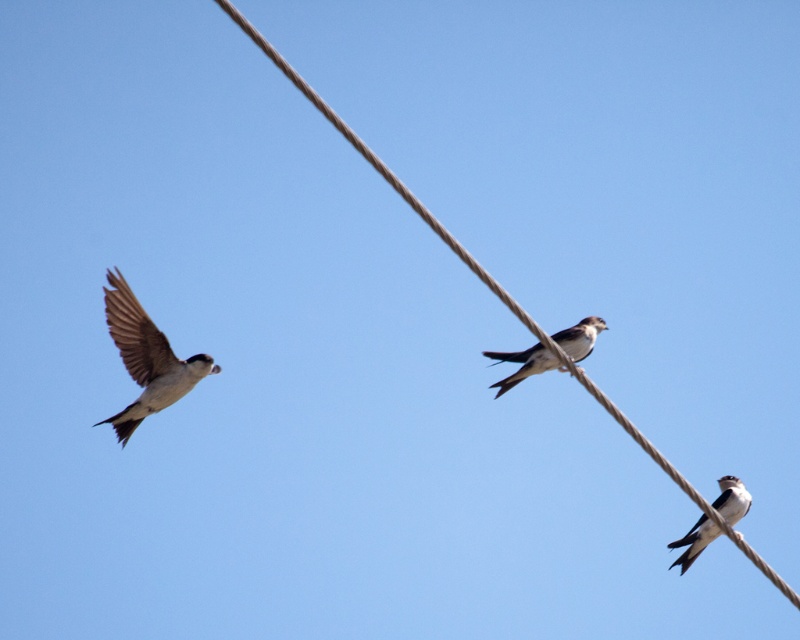
Question: Which object appears closest to the camera in this image?

Choices:
 (A) white glossy swallow at left
 (B) brown rope wire at center

Answer: (B)

Question: Is brown rope wire at center closer to the viewer compared to white matte bird at center?

Choices:
 (A) no
 (B) yes

Answer: (B)

Question: Does white glossy swallow at center appear under white matte bird at center?

Choices:
 (A) no
 (B) yes

Answer: (A)

Question: Which of the following is the closest to the observer?

Choices:
 (A) (724, 529)
 (B) (118, 412)
 (C) (670, 547)

Answer: (B)

Question: Does brown rope wire at center have a smaller size compared to white glossy swallow at center?

Choices:
 (A) no
 (B) yes

Answer: (A)

Question: Based on their relative distances, which object is farther from the white matte bird at center?

Choices:
 (A) brown rope wire at center
 (B) white glossy swallow at left
 (C) white glossy swallow at center

Answer: (B)